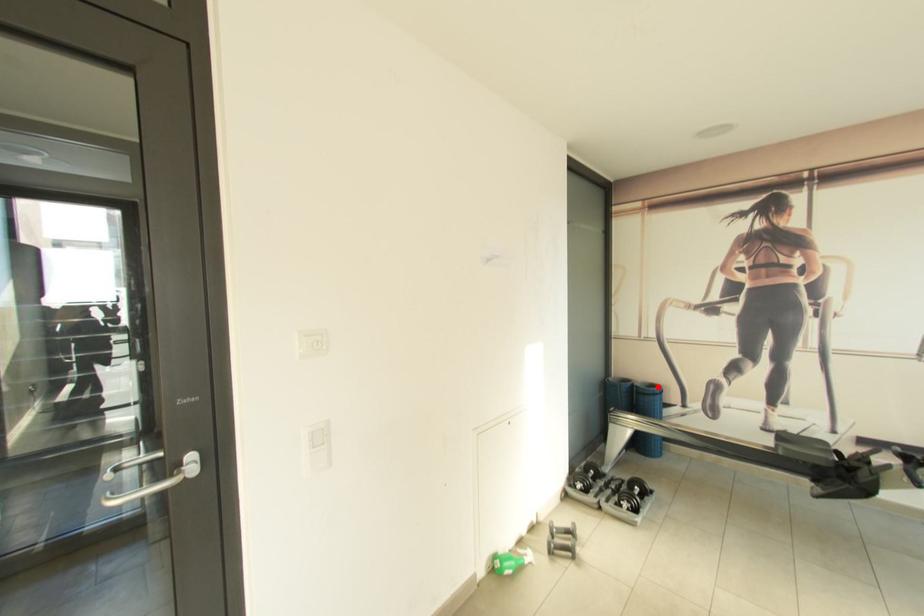
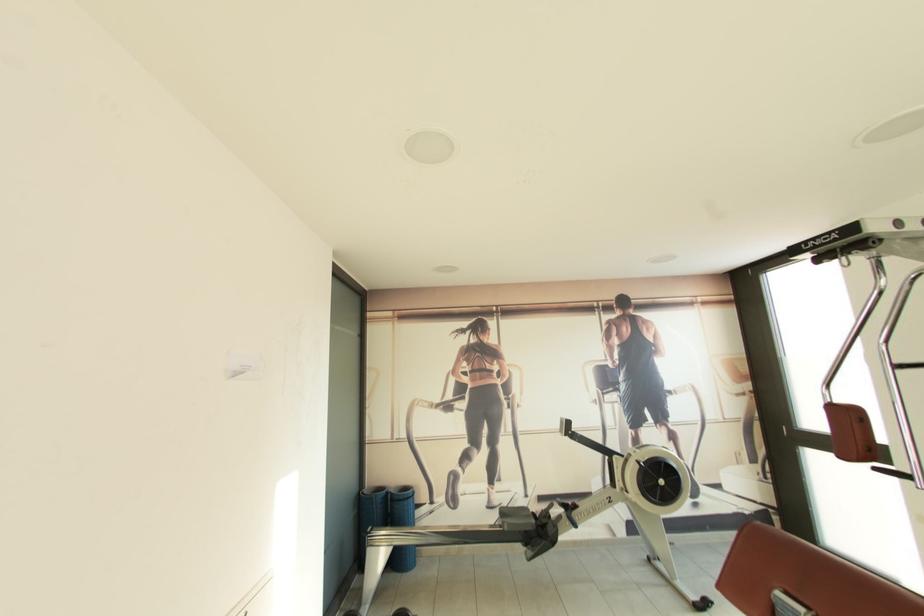
Question: I am providing you with two images of the same scene from different viewpoints. A red point is marked on the first image. Is the red point's position out of view in image 2?

Choices:
 (A) Yes
 (B) No

Answer: (B)